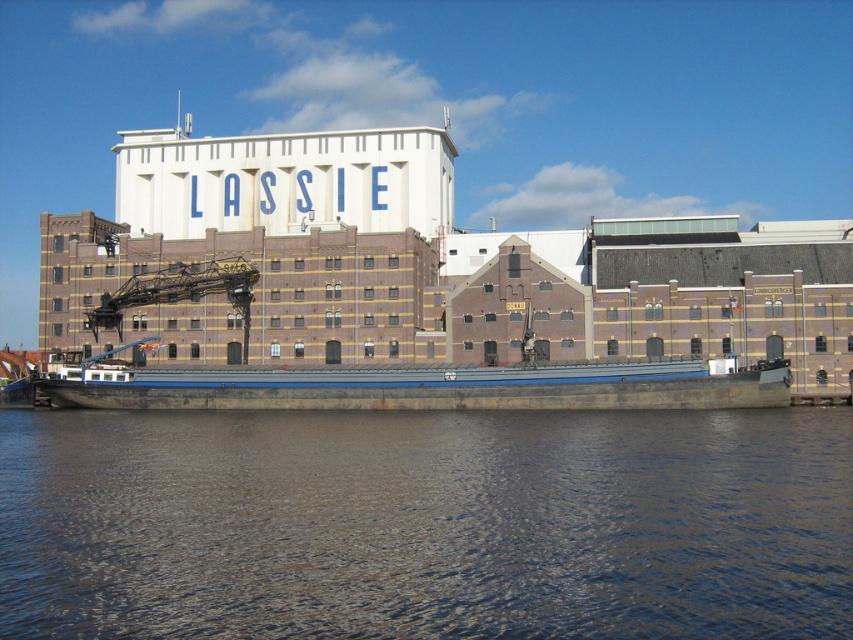
Question: Does brown water at lower center appear under blue painted steel barge at center?

Choices:
 (A) yes
 (B) no

Answer: (A)

Question: Which point is farther from the camera taking this photo?

Choices:
 (A) (583, 516)
 (B) (194, 292)
 (C) (178, 406)

Answer: (B)

Question: Which point is farther to the camera?

Choices:
 (A) blue painted steel barge at center
 (B) brown water at lower center
 (C) dark gray metallic crane at center-left

Answer: (C)

Question: Does brown water at lower center lie behind blue painted steel barge at center?

Choices:
 (A) no
 (B) yes

Answer: (A)

Question: Is blue painted steel barge at center wider than dark gray metallic crane at center-left?

Choices:
 (A) yes
 (B) no

Answer: (A)

Question: Which point is farther to the camera?

Choices:
 (A) blue painted steel barge at center
 (B) brown water at lower center
 (C) dark gray metallic crane at center-left

Answer: (C)